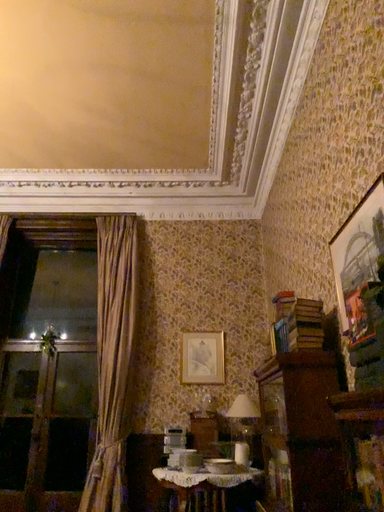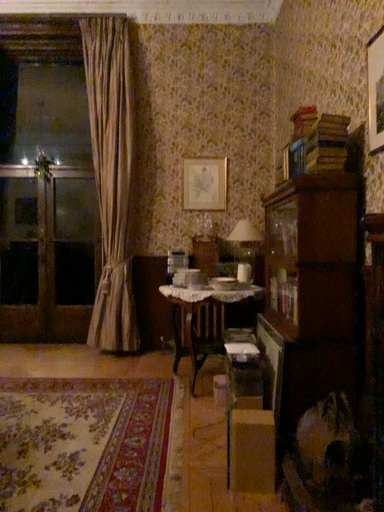
Question: How did the camera likely rotate when shooting the video?

Choices:
 (A) rotated upward
 (B) rotated downward

Answer: (B)